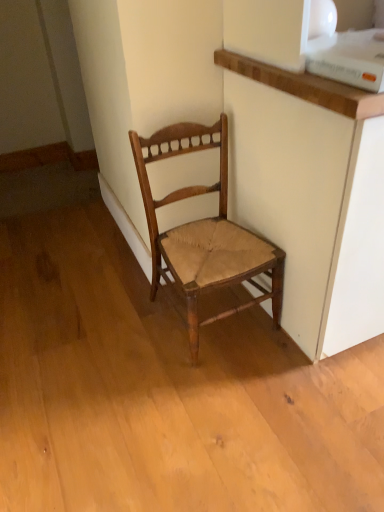
Where is `vacant region under wooden woven seat chair at center (from a real-world perspective)`? vacant region under wooden woven seat chair at center (from a real-world perspective) is located at coordinates (225, 327).